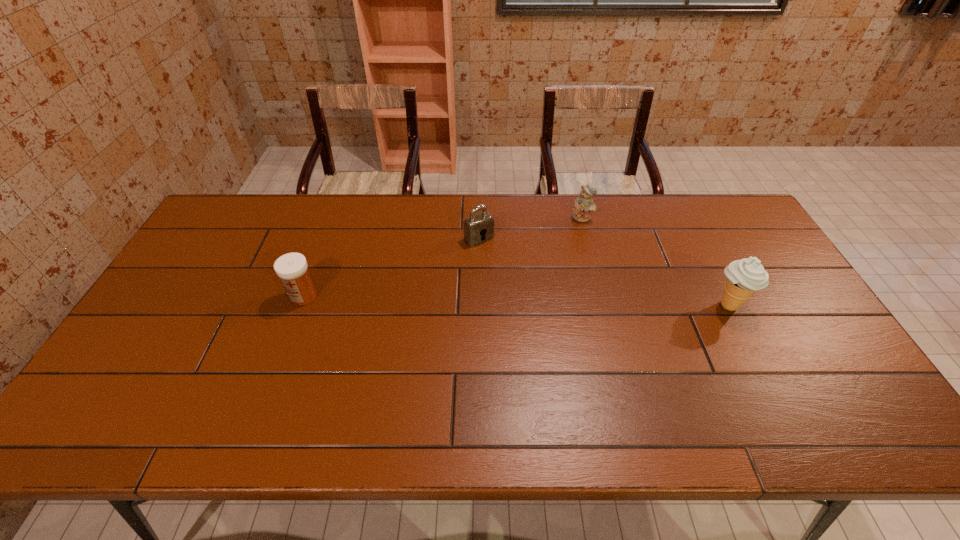
Where is `vacant area between the medicine and the third nearest object`? The width and height of the screenshot is (960, 540). vacant area between the medicine and the third nearest object is located at coordinates (392, 267).

This screenshot has width=960, height=540. Identify the location of vacant space that's between the farthest object and the second object from left to right. (531, 228).

You are a GUI agent. You are given a task and a screenshot of the screen. Output one action in this format:
    pyautogui.click(x=<x>, y=<y>)
    Task: Click on the vacant space that's between the farthest object and the padlock
    The height and width of the screenshot is (540, 960).
    Given the screenshot: What is the action you would take?
    pyautogui.click(x=531, y=228)

In order to click on free space between the second farthest object and the medicine in this screenshot , I will do `click(392, 267)`.

Identify which object is located as the nearest to the teddy bear. Please provide its 2D coordinates. Your answer should be formatted as a tuple, i.e. [(x, y)], where the tuple contains the x and y coordinates of a point satisfying the conditions above.

[(479, 227)]

Identify which object is located as the nearest to the padlock. Please provide its 2D coordinates. Your answer should be formatted as a tuple, i.e. [(x, y)], where the tuple contains the x and y coordinates of a point satisfying the conditions above.

[(584, 204)]

Identify the location of free spot that satisfies the following two spatial constraints: 1. on the back side of the medicine; 2. on the right side of the teddy bear. This screenshot has height=540, width=960. (332, 218).